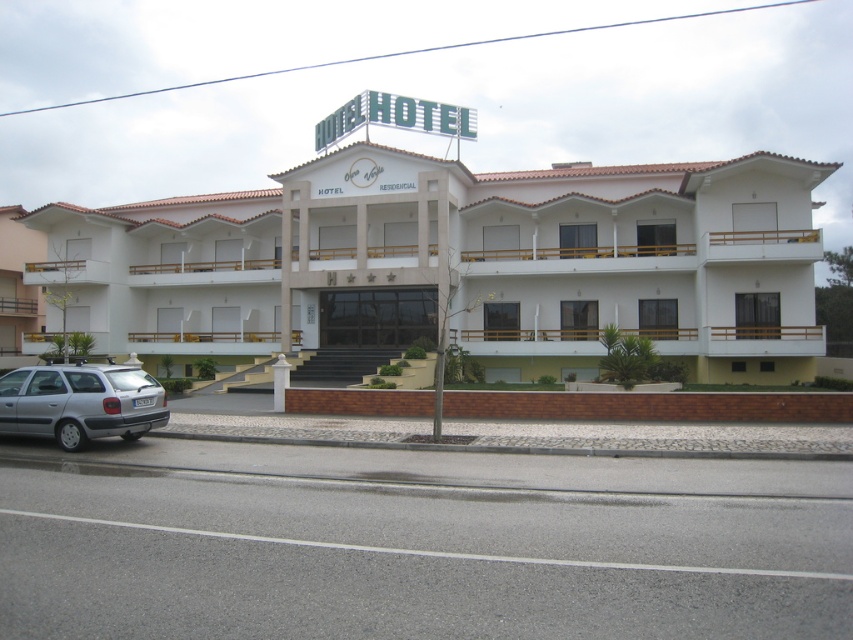
You are standing at the origin point of a coordinate system placed at the bottom left corner of the image. The white matte building at center is located at coordinates approximately where?

The white matte building at center is located at coordinates approximately 0.412 on the x axis and 0.536 on the y axis.

You are a photographer planning to capture the white matte building at center and the silver metallic car at lower left in a single frame. Considering their sizes, which object should you position closer to the camera to ensure both fit well in the composition?

The white matte building at center is wider than the silver metallic car at lower left. To ensure both fit well in the composition, you should position the white matte building at center closer to the camera since its larger size requires more space in the frame.

You are a photographer standing at the corner of the street. You want to capture both the white matte building at center and the silver metallic car at lower left in a single frame. Considering their sizes, which object should you position closer to the camera to ensure both are visible in the frame?

Since the white matte building at center is larger than the silver metallic car at lower left, you should position the silver metallic car at lower left closer to the camera to balance their sizes in the frame.